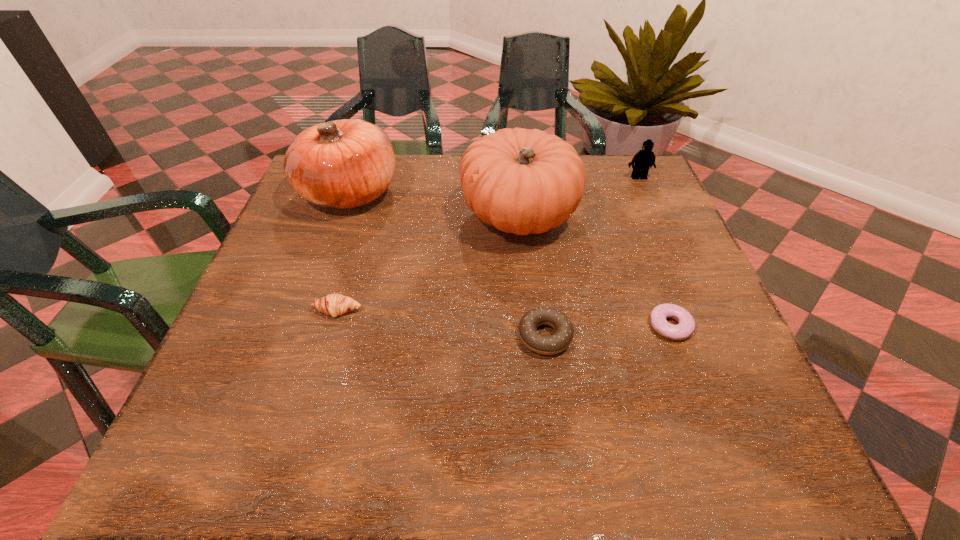
Find the location of a particular element. This screenshot has width=960, height=540. vacant point located between the right pumpkin and the pastry is located at coordinates (428, 262).

Identify the location of free space between the right pumpkin and the pastry. (428, 262).

This screenshot has width=960, height=540. I want to click on object that stands as the closest to the left pumpkin, so click(521, 181).

The width and height of the screenshot is (960, 540). In order to click on the fourth closest object to the right doughnut in this screenshot , I will do `click(334, 305)`.

Image resolution: width=960 pixels, height=540 pixels. In order to click on free location that satisfies the following two spatial constraints: 1. on the front-facing side of the pastry; 2. on the right side of the left doughnut in this screenshot , I will do `click(330, 336)`.

The width and height of the screenshot is (960, 540). In order to click on free region that satisfies the following two spatial constraints: 1. on the front-facing side of the left doughnut; 2. on the right side of the pastry in this screenshot , I will do `click(330, 336)`.

This screenshot has height=540, width=960. In order to click on vacant region that satisfies the following two spatial constraints: 1. on the front-facing side of the shorter doughnut; 2. on the right side of the pastry in this screenshot , I will do tap(333, 326).